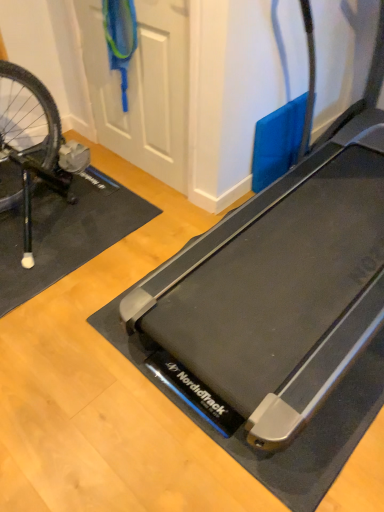
This screenshot has height=512, width=384. In order to click on vacant space to the left of white matte door at upper center in this screenshot , I will do coord(97,173).